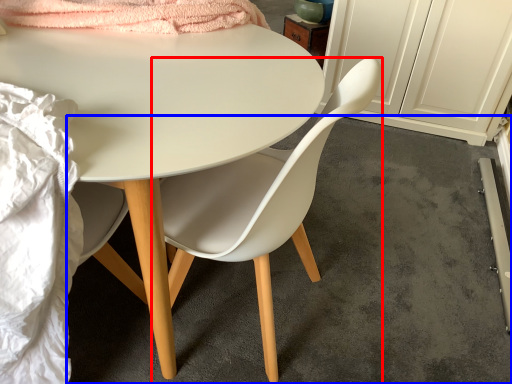
Question: Which object appears closest to the camera in this image, chair (highlighted by a red box) or concrete (highlighted by a blue box)?

Choices:
 (A) chair
 (B) concrete

Answer: (A)